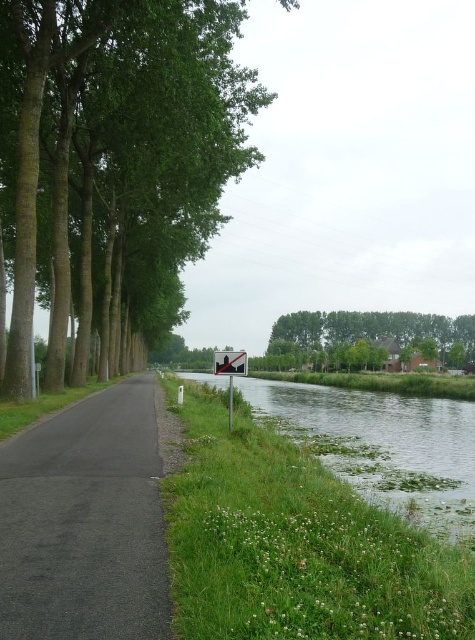
Is green grassy river at center positioned in front of metallic reflective sign at center?

Yes, green grassy river at center is in front of metallic reflective sign at center.

Locate an element on the screen. This screenshot has height=640, width=475. green grassy river at center is located at coordinates (382, 445).

Who is more distant from viewer, [407,490] or [231,420]?

The point [231,420] is behind.

You are a GUI agent. You are given a task and a screenshot of the screen. Output one action in this format:
    pyautogui.click(x=<x>, y=<y>)
    Task: Click on the green grassy river at center
    The width and height of the screenshot is (475, 640).
    Given the screenshot: What is the action you would take?
    pyautogui.click(x=382, y=445)

What do you see at coordinates (115, 163) in the screenshot?
I see `green leafy tree at center` at bounding box center [115, 163].

Is point (107, 106) closer to camera compared to point (245, 372)?

That is False.

This screenshot has height=640, width=475. I want to click on green leafy tree at center, so click(115, 163).

Which is in front, point (161, 307) or point (218, 369)?

Point (218, 369) is more forward.

Between green leafy tree at center and reflective glass sign at center, which one has less height?

reflective glass sign at center is shorter.

Between point (110, 352) and point (220, 355), which one is positioned in front?

Point (220, 355) is in front.

This screenshot has height=640, width=475. I want to click on green leafy tree at center, so tap(115, 163).